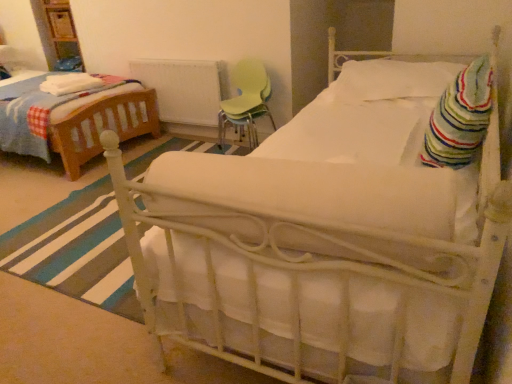
Find the location of a particular element. green plastic chair at center is located at coordinates (246, 102).

The width and height of the screenshot is (512, 384). What are the coordinates of `white soft pillow at upper right` in the screenshot? It's located at (392, 80).

Describe the element at coordinates (69, 83) in the screenshot. I see `white soft blanket at left, which is the second blanket from front to back` at that location.

At what (x,y) coordinates should I click in order to perform the action: click on white soft blanket at left, marked as the 1th blanket in a left-to-right arrangement. Please return your answer as a coordinate pair (x, y). This screenshot has height=384, width=512. Looking at the image, I should click on (69, 83).

At what (x,y) coordinates should I click in order to perform the action: click on striped cotton blanket at right, the 2th blanket in the back-to-front sequence. Please return your answer as a coordinate pair (x, y). Image resolution: width=512 pixels, height=384 pixels. Looking at the image, I should click on (460, 118).

Is white soft blanket at left, which is the 1th blanket in back-to-front order, to the right of white soft pillow at upper right from the viewer's perspective?

In fact, white soft blanket at left, which is the 1th blanket in back-to-front order, is to the left of white soft pillow at upper right.

Can we say white soft blanket at left, marked as the 1th blanket in a left-to-right arrangement, lies outside white soft pillow at upper right?

Absolutely, white soft blanket at left, marked as the 1th blanket in a left-to-right arrangement, is external to white soft pillow at upper right.

Is white soft blanket at left, marked as the 1th blanket in a left-to-right arrangement, next to white soft pillow at upper right?

No, white soft blanket at left, marked as the 1th blanket in a left-to-right arrangement, is not touching white soft pillow at upper right.

Is white soft blanket at left, placed as the 2th blanket when sorted from right to left, positioned with its back to white soft pillow at upper right?

No, white soft blanket at left, placed as the 2th blanket when sorted from right to left, is not facing the opposite direction of white soft pillow at upper right.

Can white painted metal radiator at center be found inside white soft pillow at upper right?

No, white soft pillow at upper right does not contain white painted metal radiator at center.

From the picture: From a real-world perspective, is white soft pillow at upper right above or below white painted metal radiator at center?

Clearly, from a real-world perspective, white soft pillow at upper right is above white painted metal radiator at center.

From the image's perspective, is white soft pillow at upper right located above or below white painted metal radiator at center?

From the image's perspective, white soft pillow at upper right appears below white painted metal radiator at center.

Measure the distance from white soft pillow at upper right to white painted metal radiator at center.

white soft pillow at upper right and white painted metal radiator at center are 1.36 meters apart from each other.

Is point (65, 77) less distant than point (456, 120)?

No, it is not.

Considering the relative sizes of white soft blanket at left, which is the 1th blanket in back-to-front order, and striped cotton blanket at right, arranged as the second blanket when viewed from the top, in the image provided, is white soft blanket at left, which is the 1th blanket in back-to-front order, smaller than striped cotton blanket at right, arranged as the second blanket when viewed from the top,?

Indeed, white soft blanket at left, which is the 1th blanket in back-to-front order, has a smaller size compared to striped cotton blanket at right, arranged as the second blanket when viewed from the top.

How much distance is there between white soft blanket at left, arranged as the second blanket when ordered from the bottom, and striped cotton blanket at right, acting as the 1th blanket starting from the right?

white soft blanket at left, arranged as the second blanket when ordered from the bottom, is 2.70 meters away from striped cotton blanket at right, acting as the 1th blanket starting from the right.

Does white soft blanket at left, which is the 1th blanket in back-to-front order, turn towards striped cotton blanket at right, the 2th blanket in the back-to-front sequence?

Yes, white soft blanket at left, which is the 1th blanket in back-to-front order, is aimed at striped cotton blanket at right, the 2th blanket in the back-to-front sequence.

From a real-world perspective, is white soft blanket at left, positioned as the first blanket in top-to-bottom order, above or below white painted metal radiator at center?

Clearly, from a real-world perspective, white soft blanket at left, positioned as the first blanket in top-to-bottom order, is above white painted metal radiator at center.

Is white soft blanket at left, positioned as the first blanket in top-to-bottom order, taller or shorter than white painted metal radiator at center?

Considering their sizes, white soft blanket at left, positioned as the first blanket in top-to-bottom order, has less height than white painted metal radiator at center.

Based on the photo, is white fabric bed at center oriented towards white soft blanket at left, which is the second blanket from front to back?

No, white fabric bed at center does not turn towards white soft blanket at left, which is the second blanket from front to back.

Is point (48, 229) behind point (72, 80)?

That is False.

Can you confirm if white fabric bed at center is shorter than white soft blanket at left, positioned as the first blanket in top-to-bottom order?

Correct, white fabric bed at center is not as tall as white soft blanket at left, positioned as the first blanket in top-to-bottom order.

Looking at this image, from a real-world perspective, between white fabric bed at center and white soft blanket at left, positioned as the first blanket in top-to-bottom order, who is vertically higher?

From a 3D spatial view, white soft blanket at left, positioned as the first blanket in top-to-bottom order, is above.

Measure the distance between white soft blanket at left, which is the second blanket from front to back, and white fabric bed at center.

white soft blanket at left, which is the second blanket from front to back, is 3.56 feet away from white fabric bed at center.

Is white soft blanket at left, positioned as the first blanket in top-to-bottom order, looking in the opposite direction of white fabric bed at center?

No, white fabric bed at center is not at the back of white soft blanket at left, positioned as the first blanket in top-to-bottom order.

Which of these two, white soft blanket at left, which is the second blanket from front to back, or white fabric bed at center, stands taller?

With more height is white soft blanket at left, which is the second blanket from front to back.

At what (x,y) coordinates should I click in order to perform the action: click on stripe beneath the white soft blanket at left, arranged as the second blanket when ordered from the bottom (from a real-world perspective). Please return your answer as a coordinate pair (x, y). The height and width of the screenshot is (384, 512). Looking at the image, I should click on (76, 250).

Based on their positions, is white fabric bed at center located to the left or right of white painted metal radiator at center?

From the image, it's evident that white fabric bed at center is to the right of white painted metal radiator at center.

Which object is thinner, white fabric bed at center or white painted metal radiator at center?

Thinner between the two is white painted metal radiator at center.

I want to click on stripe in front of the white painted metal radiator at center, so (x=76, y=250).

From the image's perspective, which object appears higher, white fabric bed at center or white painted metal radiator at center?

white painted metal radiator at center, from the image's perspective.

Where is `pillow that is on the right side of white soft blanket at left, positioned as the first blanket in top-to-bottom order`? This screenshot has width=512, height=384. pillow that is on the right side of white soft blanket at left, positioned as the first blanket in top-to-bottom order is located at coordinates (392, 80).

In order to click on pillow above the white painted metal radiator at center (from a real-world perspective) in this screenshot , I will do `click(392, 80)`.

When comparing their distances from green plastic chair at center, does white painted metal radiator at center or striped cotton blanket at right, the 2th blanket in the back-to-front sequence, seem further?

striped cotton blanket at right, the 2th blanket in the back-to-front sequence, is positioned further to the anchor green plastic chair at center.

Looking at the image, which one is located closer to white painted metal radiator at center, striped cotton blanket at right, which is the 1th blanket in bottom-to-top order, or white soft pillow at upper right?

white soft pillow at upper right is closer to white painted metal radiator at center.

Looking at the image, which one is located closer to white soft pillow at upper right, green plastic chair at center or white soft blanket at left, positioned as the first blanket in top-to-bottom order?

The object closer to white soft pillow at upper right is green plastic chair at center.

Based on their spatial positions, is white painted metal radiator at center or green plastic chair at center closer to white fabric bed at center?

Based on the image, green plastic chair at center appears to be nearer to white fabric bed at center.

Looking at this image, when comparing their distances from striped cotton blanket at right, which is the 1th blanket in bottom-to-top order, does white painted metal radiator at center or white soft pillow at upper right seem further?

white painted metal radiator at center lies further to striped cotton blanket at right, which is the 1th blanket in bottom-to-top order, than the other object.

When comparing their distances from white fabric bed at center, does green plastic chair at center or white painted metal radiator at center seem further?

Among the two, white painted metal radiator at center is located further to white fabric bed at center.

Based on their spatial positions, is white soft pillow at upper right or white soft blanket at left, placed as the 2th blanket when sorted from right to left, further from white painted metal radiator at center?

Based on the image, white soft pillow at upper right appears to be further to white painted metal radiator at center.

Based on their spatial positions, is striped cotton blanket at right, which ranks as the 1th blanket in front-to-back order, or white fabric bed at center further from white soft pillow at upper right?

The object further to white soft pillow at upper right is white fabric bed at center.

At what (x,y) coordinates should I click in order to perform the action: click on stripe positioned between striped cotton blanket at right, arranged as the second blanket when viewed from the top, and white painted metal radiator at center from near to far. Please return your answer as a coordinate pair (x, y). Looking at the image, I should click on (76, 250).

At what (x,y) coordinates should I click in order to perform the action: click on radiator between white soft blanket at left, which is the second blanket from front to back, and green plastic chair at center, in the horizontal direction. Please return your answer as a coordinate pair (x, y). Looking at the image, I should click on (185, 88).

I want to click on stripe between striped cotton blanket at right, which ranks as the 1th blanket in front-to-back order, and green plastic chair at center, along the z-axis, so click(x=76, y=250).

You are a GUI agent. You are given a task and a screenshot of the screen. Output one action in this format:
    pyautogui.click(x=<x>, y=<y>)
    Task: Click on the stripe between white soft blanket at left, placed as the 2th blanket when sorted from right to left, and striped cotton blanket at right, the 2th blanket in the back-to-front sequence, in the horizontal direction
    The height and width of the screenshot is (384, 512).
    Given the screenshot: What is the action you would take?
    pyautogui.click(x=76, y=250)